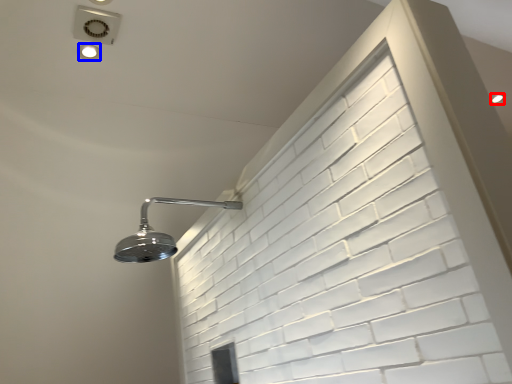
Question: Which object appears closest to the camera in this image, droplight (highlighted by a red box) or droplight (highlighted by a blue box)?

Choices:
 (A) droplight
 (B) droplight

Answer: (B)